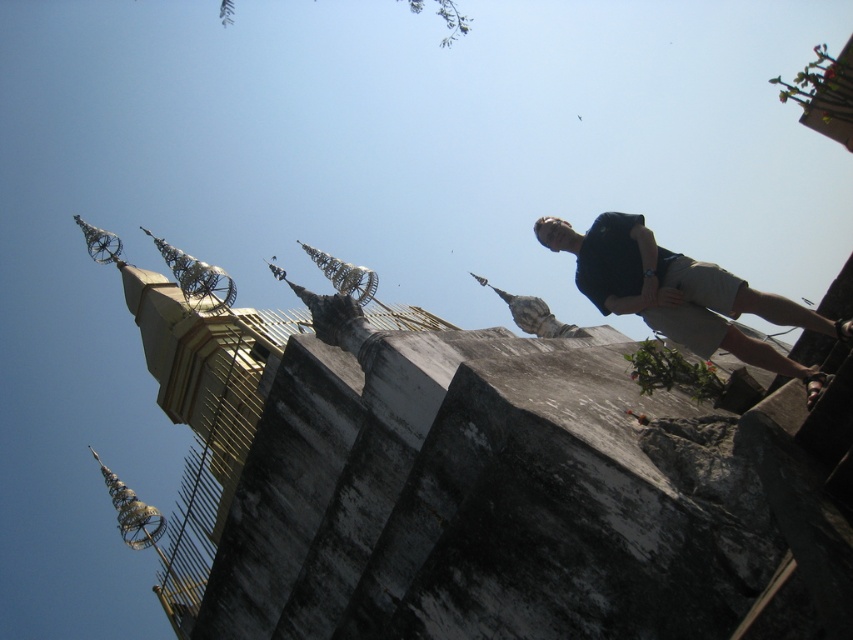
You are standing at the base of the temple structure and want to locate the gold metallic spire at upper left. According to the coordinates provided, where should you look?

You should look at point [195,403] to locate the gold metallic spire at upper left.